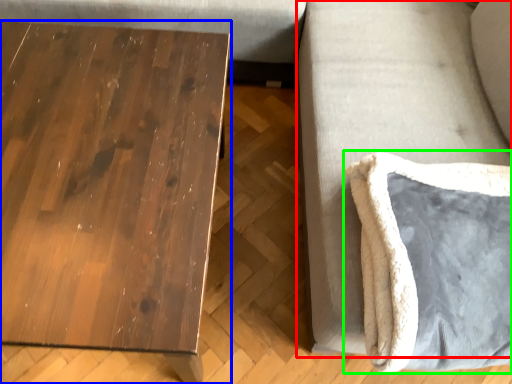
Question: Based on their relative distances, which object is farther from couch (highlighted by a red box)? Choose from table (highlighted by a blue box) and swivel chair (highlighted by a green box).

Choices:
 (A) table
 (B) swivel chair

Answer: (A)